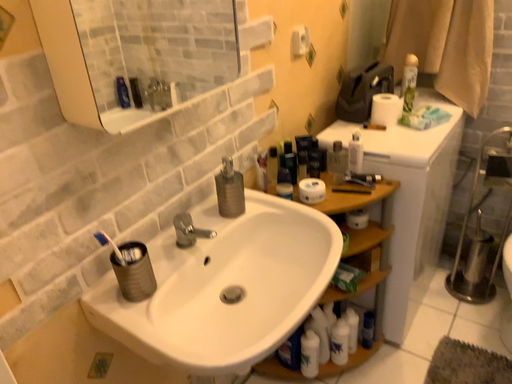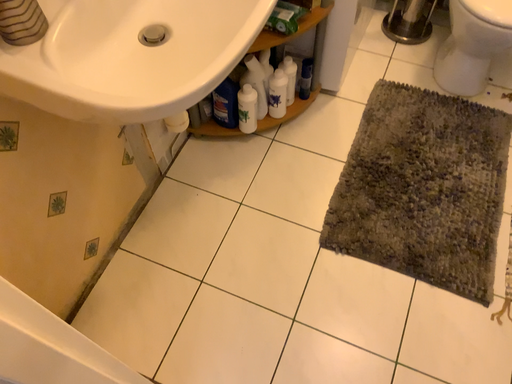
Question: Which way did the camera rotate in the video?

Choices:
 (A) rotated downward
 (B) rotated upward

Answer: (A)